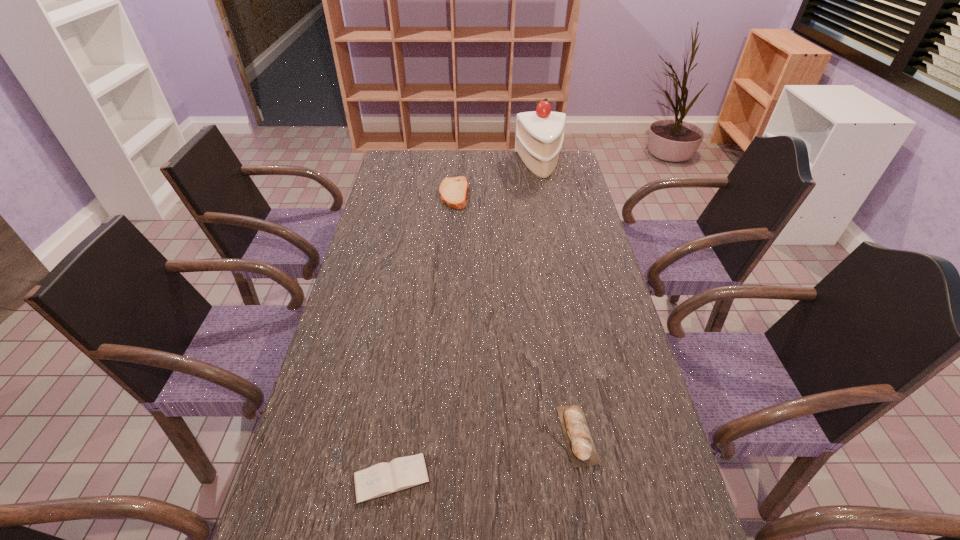
Locate an element on the screen. vacant space that satisfies the following two spatial constraints: 1. on the back side of the cake; 2. on the right side of the nearer pita bread is located at coordinates (531, 164).

Locate an element on the screen. The width and height of the screenshot is (960, 540). free location that satisfies the following two spatial constraints: 1. on the front side of the left pita bread; 2. on the right side of the right pita bread is located at coordinates (435, 435).

The width and height of the screenshot is (960, 540). I want to click on vacant region that satisfies the following two spatial constraints: 1. on the back side of the tallest object; 2. on the right side of the shortest object, so click(437, 164).

Image resolution: width=960 pixels, height=540 pixels. In order to click on blank space that satisfies the following two spatial constraints: 1. on the back side of the tallest object; 2. on the right side of the farther pita bread in this screenshot , I will do `click(456, 164)`.